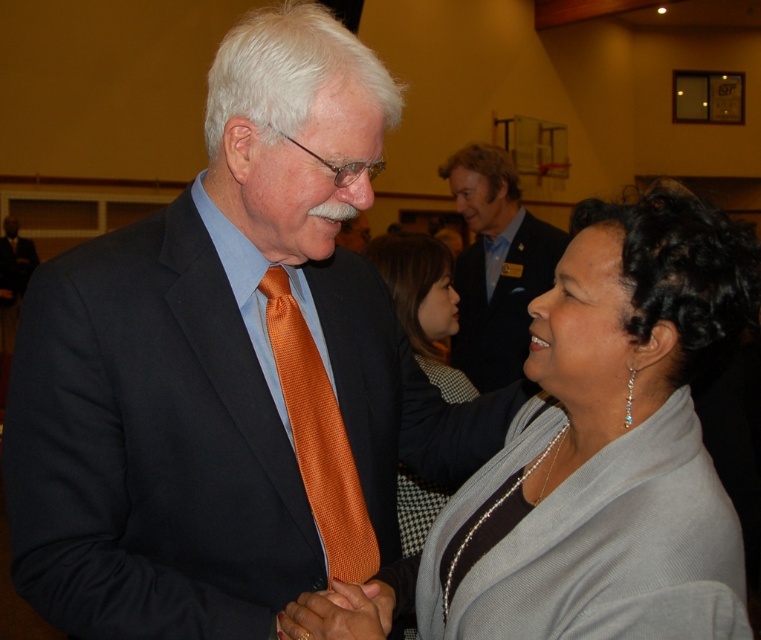
Is matte black suit at center positioned behind orange satin tie at center?

No, it is not.

The width and height of the screenshot is (761, 640). Identify the location of matte black suit at center. (228, 369).

This screenshot has width=761, height=640. I want to click on matte black suit at center, so [x=228, y=369].

Can you confirm if blue textured suit at upper center is bigger than orange satin tie at center?

Correct, blue textured suit at upper center is larger in size than orange satin tie at center.

Is blue textured suit at upper center positioned in front of orange satin tie at center?

No, it is not.

The image size is (761, 640). What do you see at coordinates (495, 266) in the screenshot? I see `blue textured suit at upper center` at bounding box center [495, 266].

The image size is (761, 640). Identify the location of blue textured suit at upper center. (495, 266).

Who is more forward, (336, 196) or (482, 268)?

Point (336, 196)

Is point (113, 292) positioned behind point (460, 284)?

No, (113, 292) is in front of (460, 284).

Which is behind, point (250, 506) or point (462, 282)?

The point (462, 282) is more distant.

Locate an element on the screen. This screenshot has width=761, height=640. matte black suit at center is located at coordinates (228, 369).